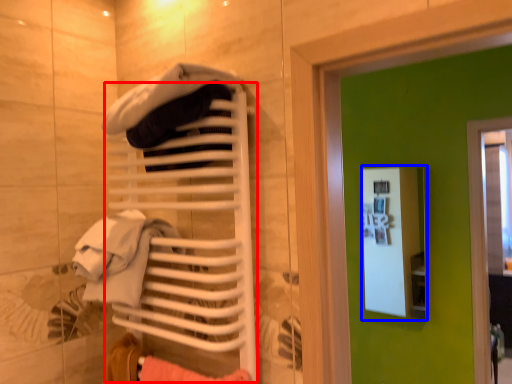
Question: Which object appears closest to the camera in this image, closet (highlighted by a red box) or medicine cabinet (highlighted by a blue box)?

Choices:
 (A) closet
 (B) medicine cabinet

Answer: (A)